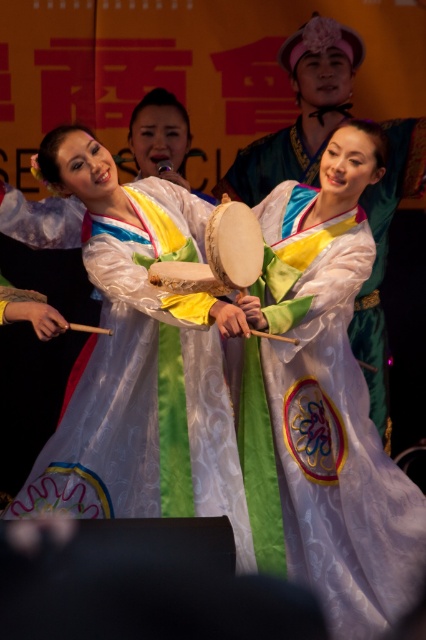
Does silky white robe at center have a smaller size compared to light brown wooden drum at center?

No, silky white robe at center is not smaller than light brown wooden drum at center.

Which is in front, point (288, 464) or point (242, 234)?

Point (242, 234) is in front.

Where is `silky white robe at center`? This screenshot has height=640, width=426. silky white robe at center is located at coordinates (322, 404).

Is point (114, 300) closer to camera compared to point (221, 248)?

No, (114, 300) is further to viewer.

This screenshot has height=640, width=426. What do you see at coordinates (140, 362) in the screenshot?
I see `white satin dress at center` at bounding box center [140, 362].

What do you see at coordinates (140, 362) in the screenshot? I see `white satin dress at center` at bounding box center [140, 362].

Find the location of `white satin dress at center`. white satin dress at center is located at coordinates (140, 362).

Between silky white robe at center and white satin dress at center, which one is positioned lower?

Positioned lower is silky white robe at center.

Where is `silky white robe at center`? This screenshot has width=426, height=640. silky white robe at center is located at coordinates (322, 404).

Find the location of `silky white robe at center`. silky white robe at center is located at coordinates (322, 404).